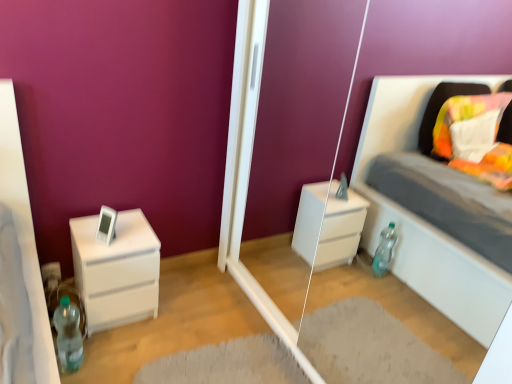
Question: Is white matte chest of drawers at left inside transparent glass door at center?

Choices:
 (A) no
 (B) yes

Answer: (A)

Question: Can you confirm if transparent glass door at center is thinner than white matte chest of drawers at left?

Choices:
 (A) yes
 (B) no

Answer: (A)

Question: Is transparent glass door at center oriented away from white matte chest of drawers at left?

Choices:
 (A) no
 (B) yes

Answer: (A)

Question: Is transparent glass door at center wider than white matte chest of drawers at left?

Choices:
 (A) yes
 (B) no

Answer: (B)

Question: Considering the relative sizes of transparent glass door at center and white matte chest of drawers at left in the image provided, is transparent glass door at center taller than white matte chest of drawers at left?

Choices:
 (A) no
 (B) yes

Answer: (B)

Question: Considering the relative positions of transparent glass door at center and white matte chest of drawers at left in the image provided, is transparent glass door at center to the left of white matte chest of drawers at left from the viewer's perspective?

Choices:
 (A) no
 (B) yes

Answer: (A)

Question: Does white matte chest of drawers at left appear on the right side of transparent glass door at center?

Choices:
 (A) no
 (B) yes

Answer: (A)

Question: Is white matte chest of drawers at left oriented towards transparent glass door at center?

Choices:
 (A) yes
 (B) no

Answer: (B)

Question: From the image's perspective, is white matte chest of drawers at left under transparent glass door at center?

Choices:
 (A) no
 (B) yes

Answer: (B)

Question: Is transparent glass door at center completely or partially inside white matte chest of drawers at left?

Choices:
 (A) yes
 (B) no

Answer: (B)

Question: Does white matte chest of drawers at left have a greater width compared to transparent glass door at center?

Choices:
 (A) no
 (B) yes

Answer: (B)

Question: Considering the relative sizes of white matte chest of drawers at left and transparent glass door at center in the image provided, is white matte chest of drawers at left shorter than transparent glass door at center?

Choices:
 (A) yes
 (B) no

Answer: (A)

Question: Does white matte chest of drawers at left have a greater height compared to translucent plastic bottle at lower left?

Choices:
 (A) no
 (B) yes

Answer: (B)